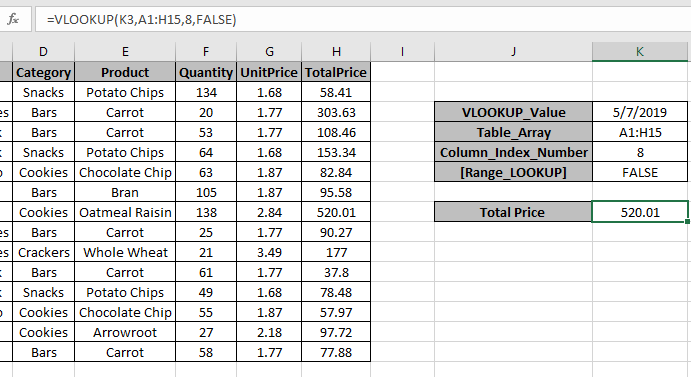
Locate an element on the screen. This screenshot has height=377, width=691. bars is located at coordinates (44, 111), (44, 131), (46, 188), (43, 229), (46, 268), (48, 354).